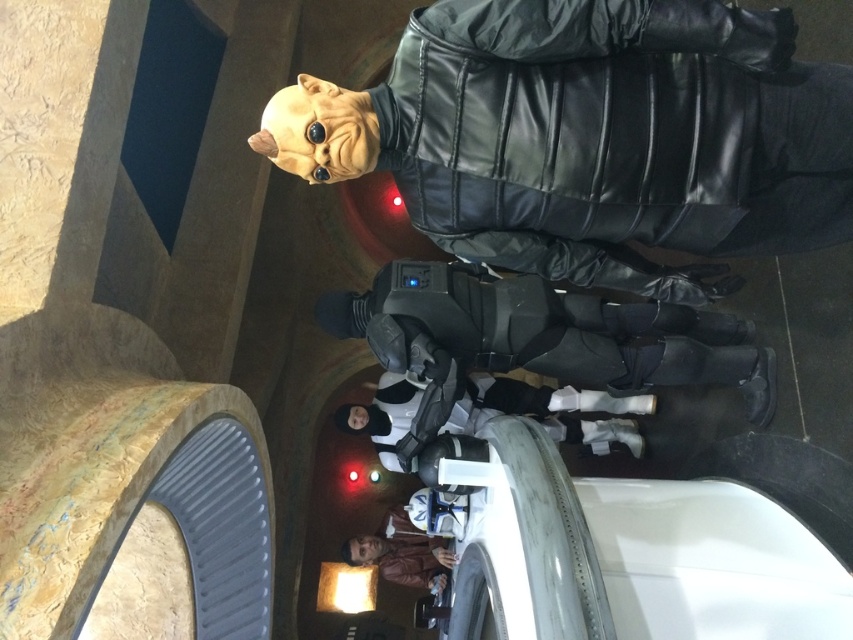
You are standing in the center of the event venue and want to locate the matte black armor at center. According to the coordinates provided, where should you look relative to your current position?

The matte black armor at center is located at coordinates point (548, 332), which means it is slightly to the right and below your current position in the venue.

You are standing in the futuristic setting and want to determine which of the two points, point (498, 392) or point (393, 540), is nearer to you. Based on the scene, which point is closer?

Point (498, 392) is closer to the viewer than point (393, 540).